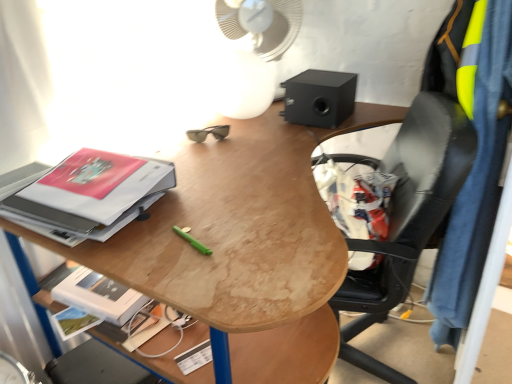
Question: Is wooden desk at center wider or thinner than matte hardcover book at left?

Choices:
 (A) thin
 (B) wide

Answer: (B)

Question: Considering the relative positions of wooden desk at center and matte hardcover book at left in the image provided, is wooden desk at center to the left or to the right of matte hardcover book at left?

Choices:
 (A) left
 (B) right

Answer: (B)

Question: Which object is the farthest from the neon yellow fabric at right?

Choices:
 (A) white plastic mechanical fan at upper center
 (B) black matte speaker at upper right
 (C) wooden desk at center
 (D) matte hardcover book at left

Answer: (D)

Question: Considering the real-world distances, which object is closest to the black matte speaker at upper right?

Choices:
 (A) matte hardcover book at left
 (B) wooden desk at center
 (C) white plastic mechanical fan at upper center
 (D) neon yellow fabric at right

Answer: (C)